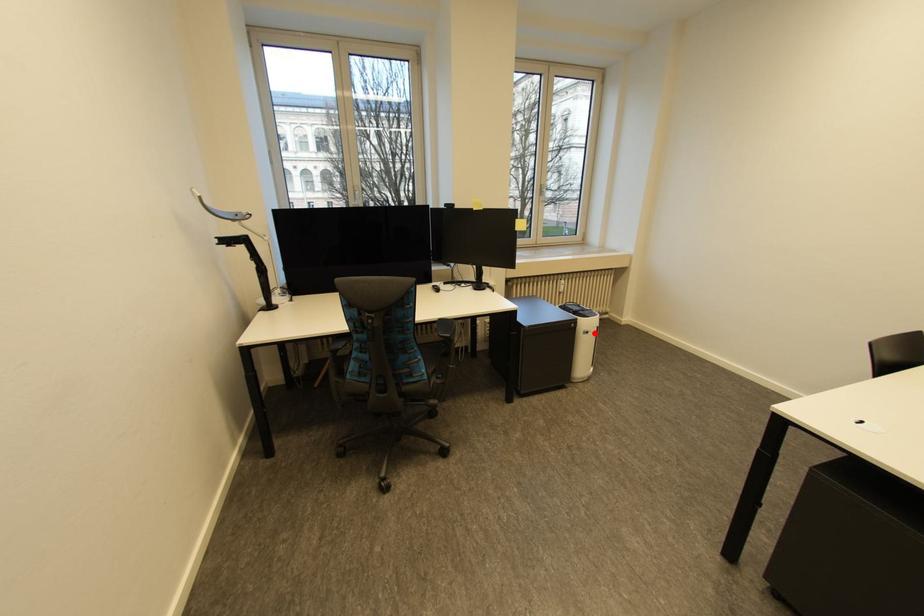
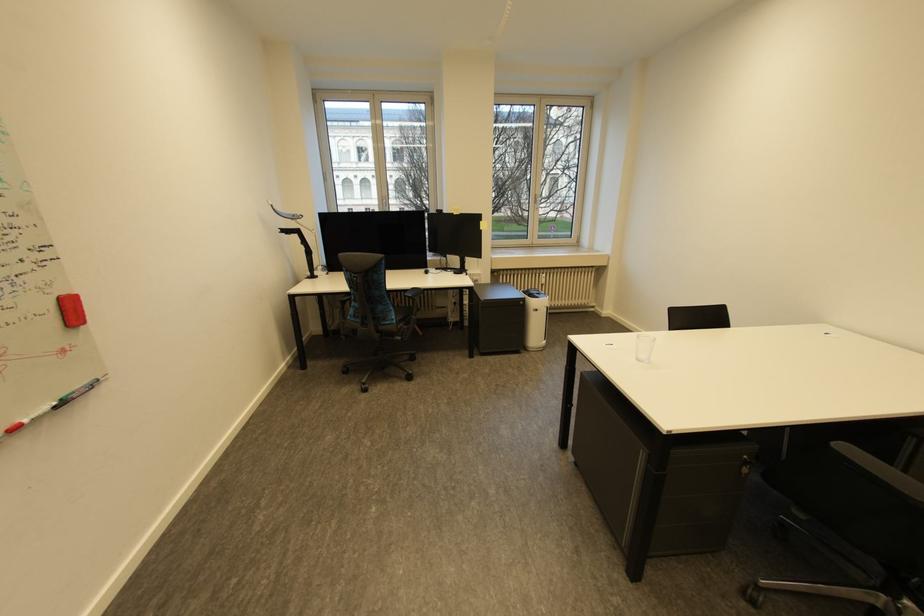
In the second image, find the point that corresponds to the highlighted location in the first image.

(543, 310)